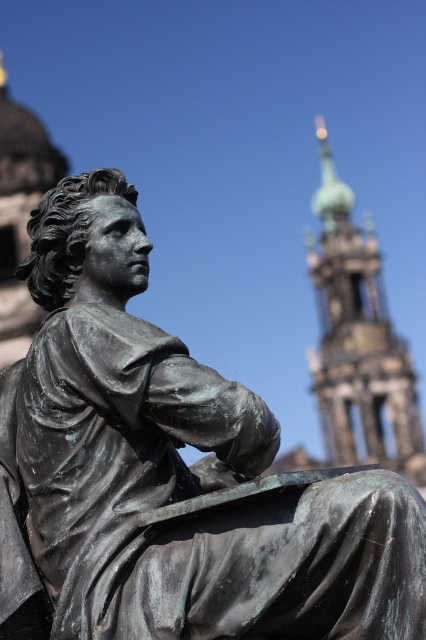
Based on the photo, is bronze statue at center to the right of green copper tower at upper right from the viewer's perspective?

Incorrect, bronze statue at center is not on the right side of green copper tower at upper right.

Can you confirm if bronze statue at center is taller than green copper tower at upper right?

In fact, bronze statue at center may be shorter than green copper tower at upper right.

Which is behind, point (207, 369) or point (396, 426)?

The point (396, 426) is behind.

Find the location of a particular element. bronze statue at center is located at coordinates [x=169, y=472].